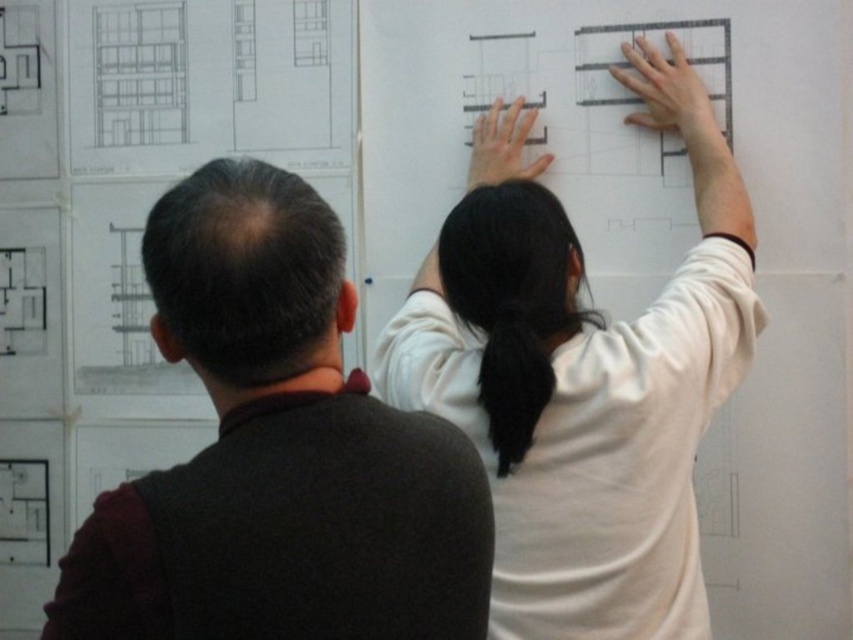
Is dark brown sweater at left shorter than white matte shirt at upper center?

Yes.

Who is positioned more to the right, dark brown sweater at left or white matte shirt at upper center?

From the viewer's perspective, white matte shirt at upper center appears more on the right side.

Does point (160, 480) lie in front of point (614, 342)?

Yes, it is.

At what (x,y) coordinates should I click in order to perform the action: click on dark brown sweater at left. Please return your answer as a coordinate pair (x, y). This screenshot has height=640, width=853. Looking at the image, I should click on (277, 452).